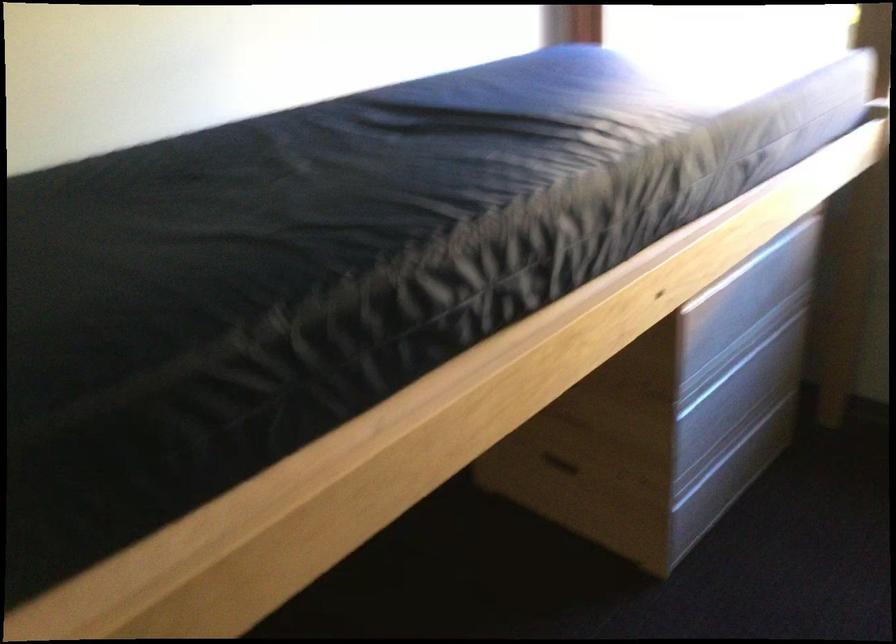
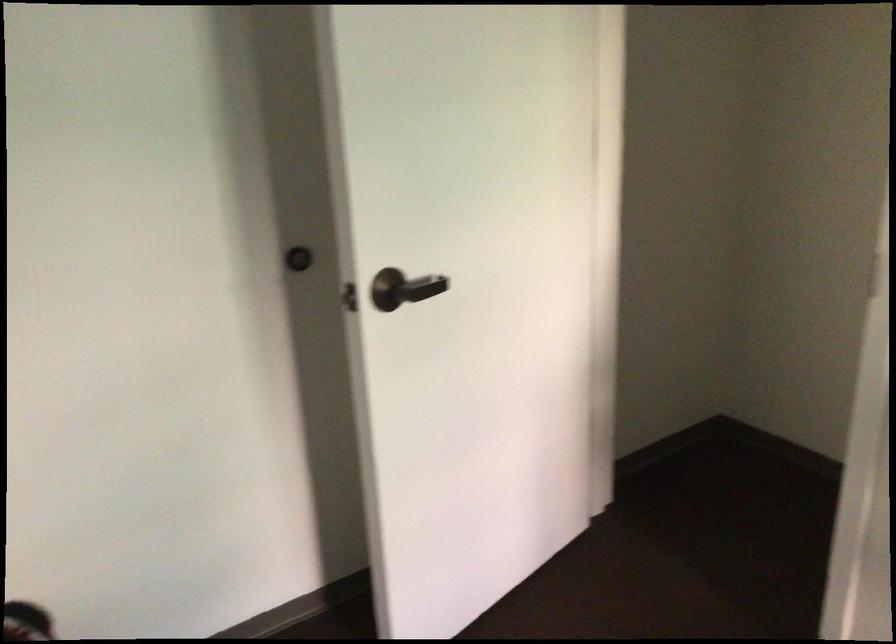
How did the camera likely rotate?

The camera's rotation is toward left-down.